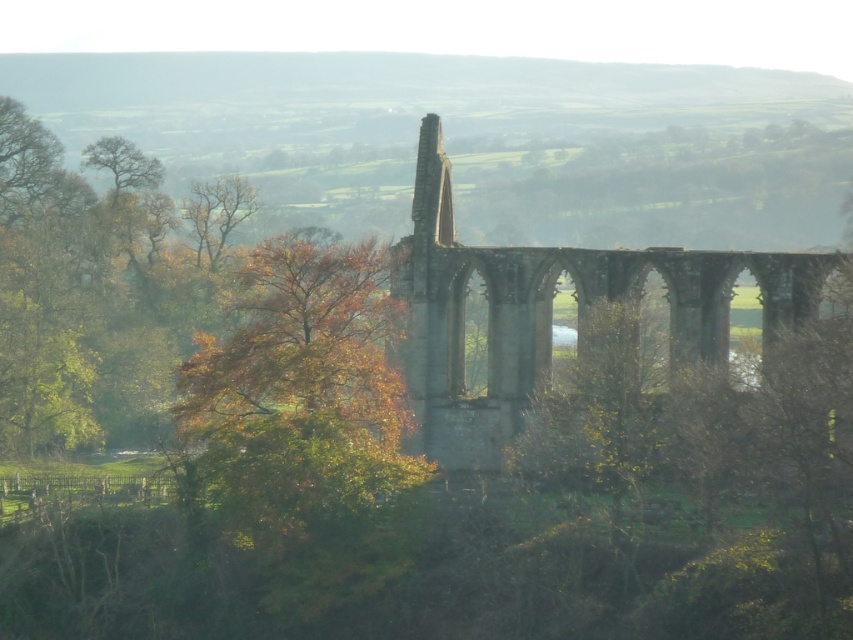
You are standing in front of the ruins and want to pick up autumn leaves at left. Which direction should you move to get closer to them compared to the stone arches at center?

The autumn leaves at left are closer to the viewer than the stone arches at center, so you should move towards the autumn leaves at left to get closer to them while moving away from the stone arches at center.

You are an artist planning to paint the scene. You want to ensure the autumn leaves at left and stone arches at center are proportionally accurate. Which object should you make wider in your painting to maintain the scene proportions?

The stone arches at center should be made wider in the painting because the autumn leaves at left has a lesser width compared to stone arches at center according to the description.

You are a painter wanting to capture the autumn leaves at left and stone arches at center in your painting. Which object should you focus on if you want to depict the larger element first?

The autumn leaves at left is bigger than stone arches at center, so you should focus on painting the autumn leaves at left first.